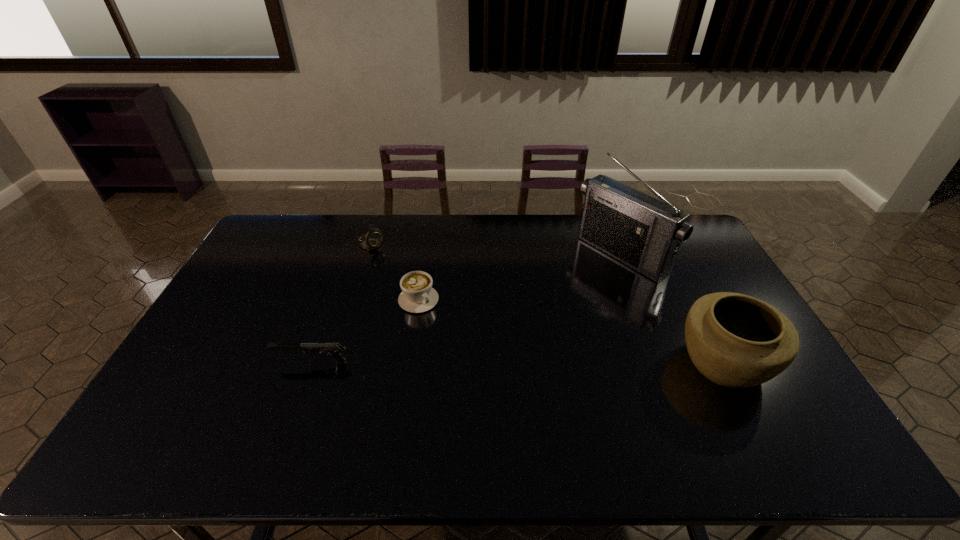
At what (x,y) coordinates should I click in order to perform the action: click on free spot between the fourth shortest object and the tallest object. Please return your answer as a coordinate pair (x, y). The image size is (960, 540). Looking at the image, I should click on (672, 309).

I want to click on free point between the second tallest object and the third object from left to right, so click(x=571, y=331).

Where is `empty location between the tallest object and the second tallest object`? This screenshot has width=960, height=540. empty location between the tallest object and the second tallest object is located at coordinates click(672, 309).

Where is `unoccupied area between the gun and the third tallest object`? unoccupied area between the gun and the third tallest object is located at coordinates (342, 303).

Where is `free space between the radio receiver and the third shortest object`? free space between the radio receiver and the third shortest object is located at coordinates (496, 250).

Where is `empty location between the cappuccino and the radio receiver`? The image size is (960, 540). empty location between the cappuccino and the radio receiver is located at coordinates (520, 278).

Identify the location of blank region between the third object from left to right and the radio receiver. This screenshot has height=540, width=960. (520, 278).

Identify the location of free space between the third object from left to right and the gun. This screenshot has height=540, width=960. point(366,331).

Identify the location of object that is the fourth nearest to the second tallest object. (372, 240).

Identify which object is the third nearest to the gun. Please provide its 2D coordinates. Your answer should be formatted as a tuple, i.e. [(x, y)], where the tuple contains the x and y coordinates of a point satisfying the conditions above.

[(645, 233)]